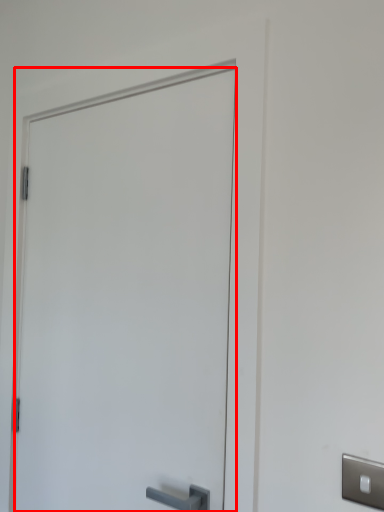
Question: Observing the image, what is the correct spatial positioning of door (annotated by the red box) in reference to light switch?

Choices:
 (A) right
 (B) left

Answer: (B)